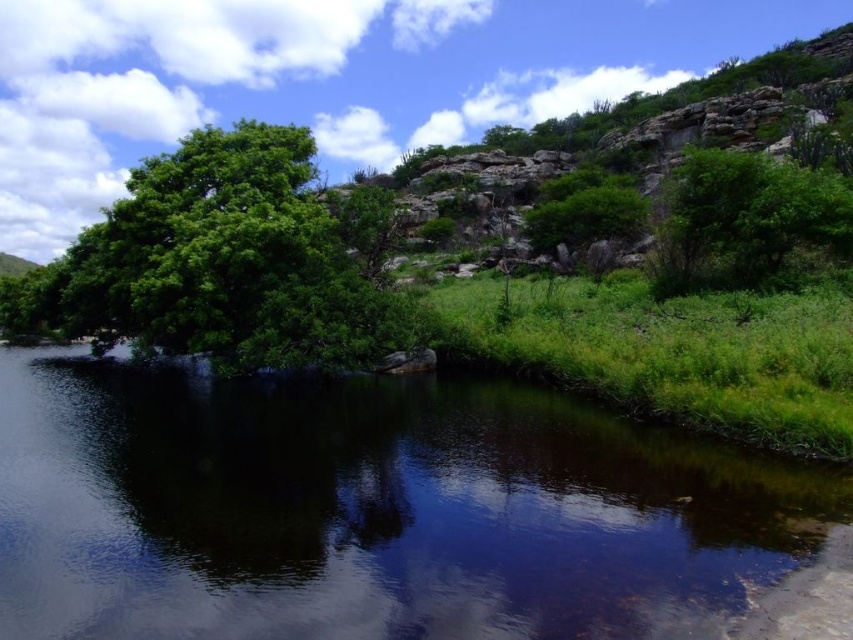
Is green grassy river at center to the right of green leafy bush at upper right from the viewer's perspective?

No, green grassy river at center is not to the right of green leafy bush at upper right.

Which is more to the left, green grassy river at center or green leafy bush at upper right?

Positioned to the left is green grassy river at center.

Is point (164, 596) closer to camera compared to point (686, 189)?

Yes, point (164, 596) is closer to viewer.

Locate an element on the screen. The height and width of the screenshot is (640, 853). green grassy river at center is located at coordinates (372, 509).

From the picture: Can you confirm if green grassy river at center is positioned below green leafy tree at left?

Yes, green grassy river at center is below green leafy tree at left.

Is point (106, 417) behind point (241, 360)?

No, (106, 417) is in front of (241, 360).

Find the location of a particular element. The width and height of the screenshot is (853, 640). green grassy river at center is located at coordinates (372, 509).

Locate an element on the screen. green grassy river at center is located at coordinates (372, 509).

Who is more distant from viewer, (305, 211) or (772, 234)?

The point (772, 234) is behind.

Where is `green leafy tree at left`? This screenshot has width=853, height=640. green leafy tree at left is located at coordinates (219, 262).